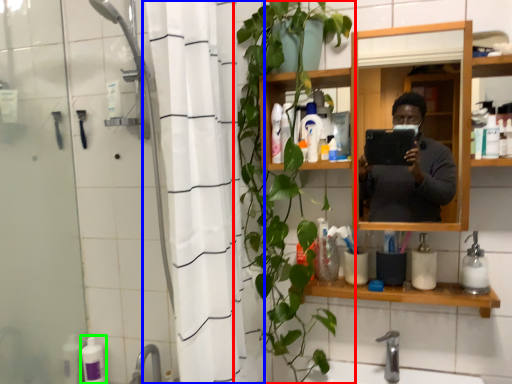
Question: Which object is positioned closest to houseplant (highlighted by a red box)? Select from shower curtain (highlighted by a blue box) and toiletry (highlighted by a green box).

Choices:
 (A) shower curtain
 (B) toiletry

Answer: (A)